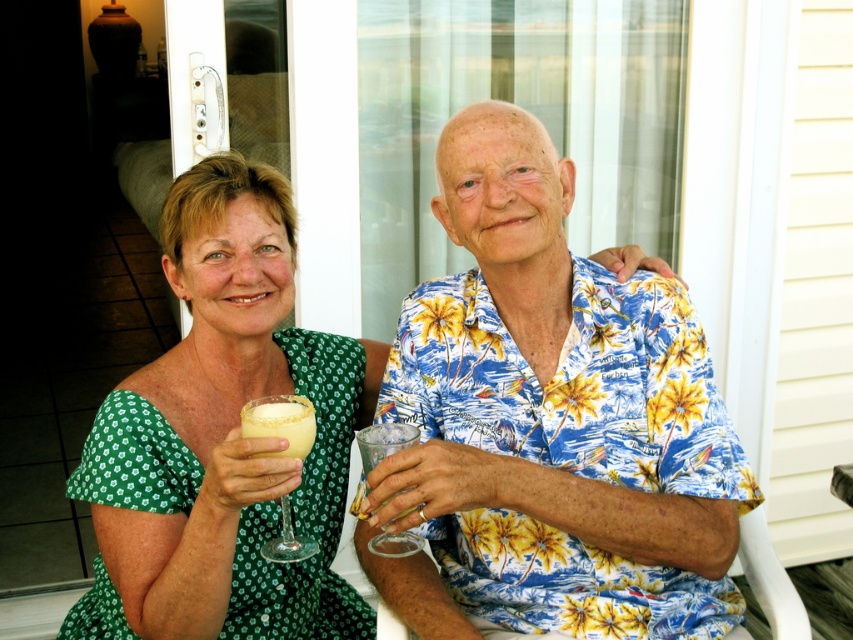
Question: In this image, where is green floral dress at center located relative to clear glass wine glass at center?

Choices:
 (A) right
 (B) left

Answer: (B)

Question: Which object is positioned farthest from the transparent glass at right?

Choices:
 (A) clear glass wine glass at center
 (B) green floral dress at center

Answer: (B)

Question: Is blue floral shirt at center to the right of green floral dress at center from the viewer's perspective?

Choices:
 (A) yes
 (B) no

Answer: (A)

Question: Which point is farther to the camera?

Choices:
 (A) (113, 504)
 (B) (549, 154)
 (C) (399, 440)

Answer: (B)

Question: Can you confirm if blue floral shirt at center is positioned below green floral dress at center?

Choices:
 (A) yes
 (B) no

Answer: (B)

Question: Which point appears farthest from the camera in this image?

Choices:
 (A) (248, 412)
 (B) (358, 442)
 (C) (334, 624)
 (D) (590, 547)

Answer: (C)